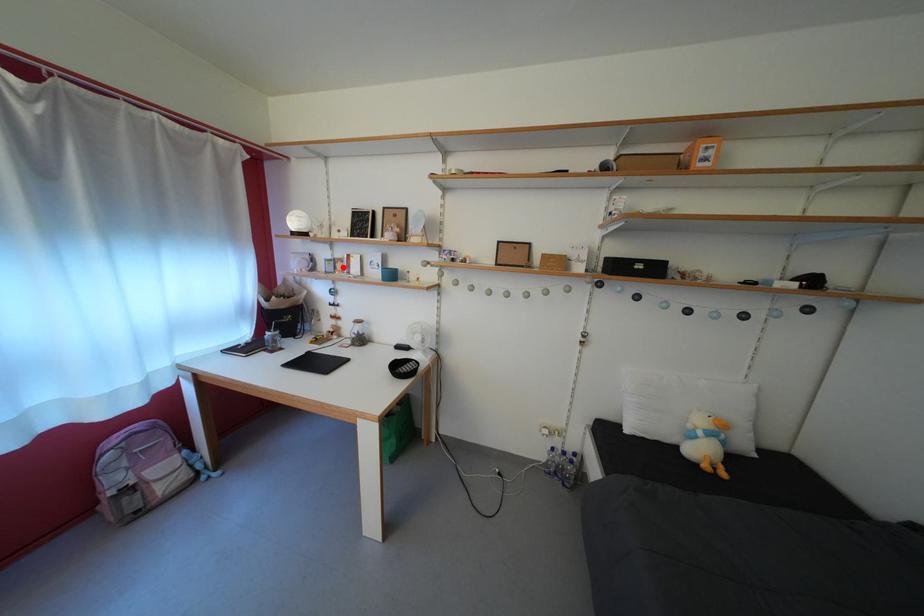
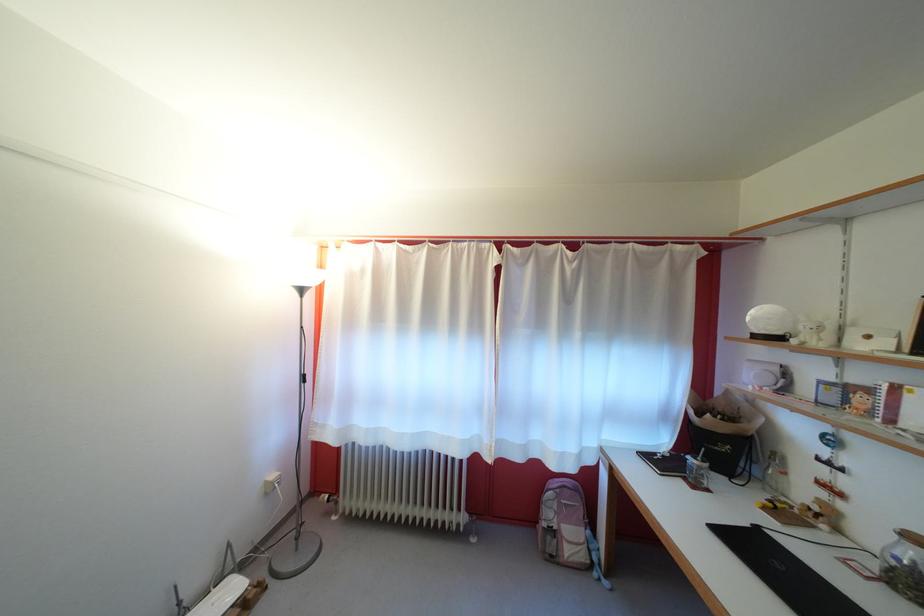
Where in the second image is the point corresponding to the highlighted location from the first image?

(855, 395)